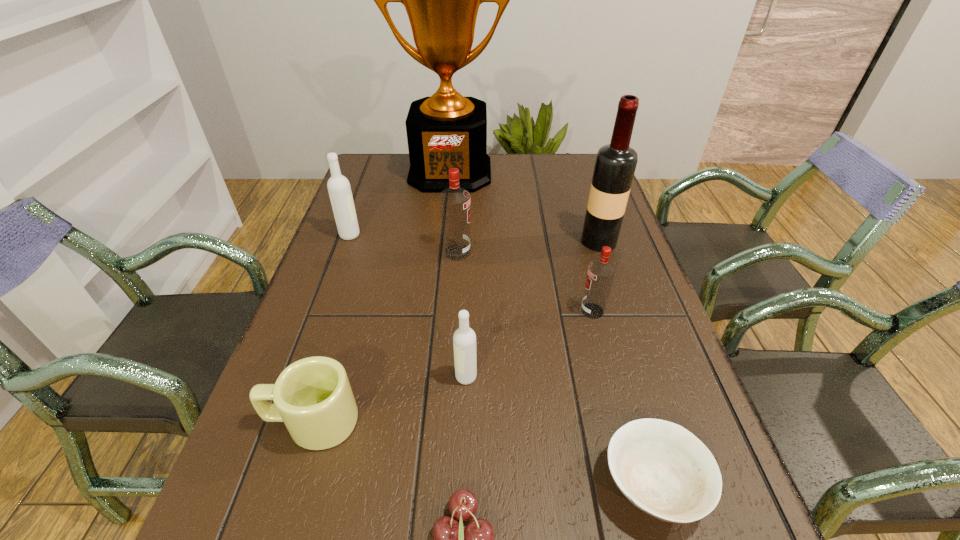
I want to click on free space at the right edge of the desktop, so click(630, 240).

You are a GUI agent. You are given a task and a screenshot of the screen. Output one action in this format:
    pyautogui.click(x=<x>, y=<y>)
    Task: Click on the vacant space at the far right corner
    The height and width of the screenshot is (540, 960).
    Given the screenshot: What is the action you would take?
    pyautogui.click(x=581, y=183)

I want to click on free area in between the bigger white vodka and the gold trophy cup, so [x=400, y=203].

The height and width of the screenshot is (540, 960). I want to click on vacant space that's between the farther red vodka and the smaller red vodka, so click(x=525, y=281).

The height and width of the screenshot is (540, 960). I want to click on vacant point located between the wine bottle and the farther red vodka, so click(x=528, y=247).

At what (x,y) coordinates should I click in order to perform the action: click on object that is the fourth closest to the fifth nearest object. Please return your answer as a coordinate pair (x, y). This screenshot has height=540, width=960. Looking at the image, I should click on (455, 202).

Image resolution: width=960 pixels, height=540 pixels. In order to click on object that is the seventh closest to the beige mug in this screenshot , I will do `click(615, 164)`.

What are the coordinates of `the second closest vodka relative to the bigger red vodka` in the screenshot? It's located at (601, 272).

Select which vodka appears as the second closest to the nearer white vodka. Please provide its 2D coordinates. Your answer should be formatted as a tuple, i.e. [(x, y)], where the tuple contains the x and y coordinates of a point satisfying the conditions above.

[(455, 202)]